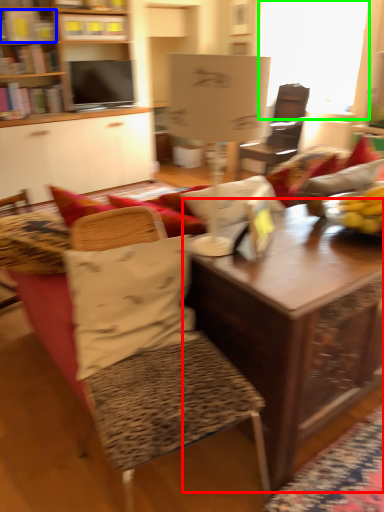
Question: Based on their relative distances, which object is farther from table (highlighted by a red box)? Choose from book (highlighted by a blue box) and window screen (highlighted by a green box).

Choices:
 (A) book
 (B) window screen

Answer: (A)